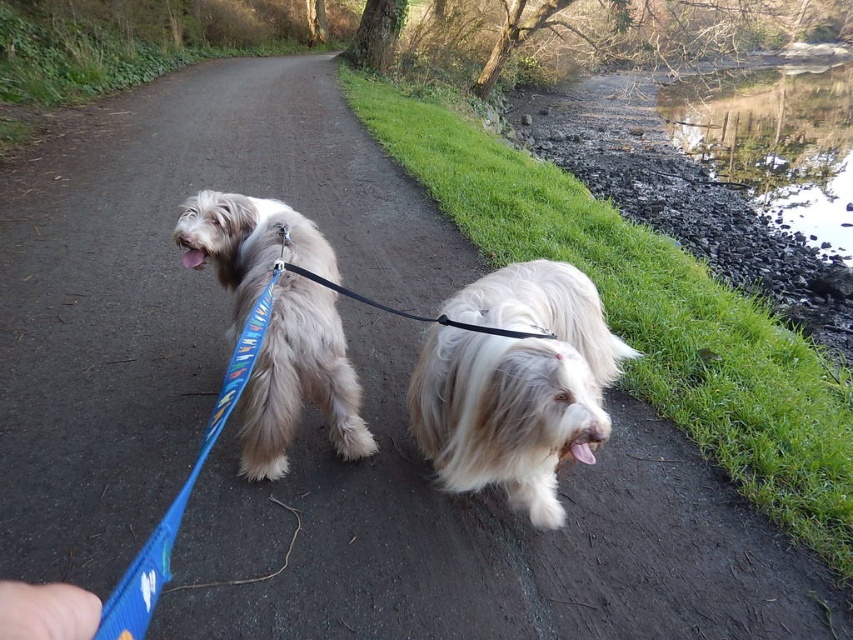
Question: Is white fluffy dog at center closer to the viewer compared to black nylon leash at center?

Choices:
 (A) no
 (B) yes

Answer: (B)

Question: Which object appears farthest from the camera in this image?

Choices:
 (A) black nylon leash at center
 (B) blue fabric leash at lower left
 (C) white fluffy dog at center
 (D) smooth gravel creek at upper right

Answer: (D)

Question: Can you confirm if fuzzy beige dog at center is positioned to the left of blue fabric leash at lower left?

Choices:
 (A) yes
 (B) no

Answer: (A)

Question: Where is white fluffy dog at center located in relation to smooth gravel creek at upper right in the image?

Choices:
 (A) left
 (B) right

Answer: (A)

Question: Based on their relative distances, which object is nearer to the fuzzy beige dog at center?

Choices:
 (A) black nylon leash at center
 (B) smooth gravel creek at upper right
 (C) blue fabric leash at lower left
 (D) white fluffy dog at center

Answer: (D)

Question: Which of the following is the closest to the observer?

Choices:
 (A) coord(45,616)
 (B) coord(279,349)
 (C) coord(312,273)

Answer: (A)